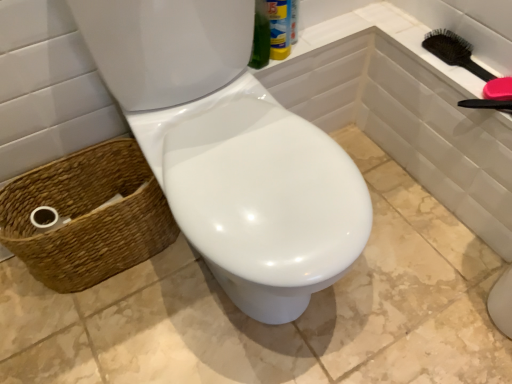
Find the location of `white glossy toilet at center`. white glossy toilet at center is located at coordinates (230, 151).

Where is `black plastic hairbrush at upper right`? Image resolution: width=512 pixels, height=384 pixels. black plastic hairbrush at upper right is located at coordinates click(454, 52).

Consider the image. Which of these two, white glossy toilet at center or woven brown basket at lower left, is wider?

woven brown basket at lower left.

How different are the orientations of white glossy toilet at center and woven brown basket at lower left in degrees?

0.00139 degrees separate the facing orientations of white glossy toilet at center and woven brown basket at lower left.

Based on the photo, how far apart are white glossy toilet at center and woven brown basket at lower left?

white glossy toilet at center is 13.34 inches away from woven brown basket at lower left.

Where is `basket behind the white glossy toilet at center`? The width and height of the screenshot is (512, 384). basket behind the white glossy toilet at center is located at coordinates (88, 216).

Is black plastic hairbrush at upper right completely or partially outside of white glossy toilet at center?

Yes, black plastic hairbrush at upper right is located beyond the bounds of white glossy toilet at center.

From a real-world perspective, is black plastic hairbrush at upper right located beneath white glossy toilet at center?

No, from a real-world perspective, black plastic hairbrush at upper right is not below white glossy toilet at center.

At what (x,y) coordinates should I click in order to perform the action: click on brush above the white glossy toilet at center (from a real-world perspective). Please return your answer as a coordinate pair (x, y). Image resolution: width=512 pixels, height=384 pixels. Looking at the image, I should click on (454, 52).

In the image, is black plastic hairbrush at upper right positioned in front of or behind white glossy toilet at center?

Visually, black plastic hairbrush at upper right is located behind white glossy toilet at center.

Visually, is black plastic hairbrush at upper right positioned to the left or to the right of woven brown basket at lower left?

Based on their positions, black plastic hairbrush at upper right is located to the right of woven brown basket at lower left.

Identify the location of brush lying on the right of woven brown basket at lower left. This screenshot has height=384, width=512. (454, 52).

Considering the positions of points (438, 52) and (1, 195), is point (438, 52) closer to camera compared to point (1, 195)?

No, it is not.

Which of these two, woven brown basket at lower left or white glossy toilet at center, stands shorter?

woven brown basket at lower left.

From the image's perspective, between woven brown basket at lower left and white glossy toilet at center, which one is located above?

white glossy toilet at center is shown above in the image.

Between woven brown basket at lower left and white glossy toilet at center, which one has smaller width?

white glossy toilet at center is thinner.

Would you say woven brown basket at lower left contains white glossy toilet at center?

That's incorrect, white glossy toilet at center is not inside woven brown basket at lower left.

Between white glossy toilet at center and black plastic hairbrush at upper right, which one has smaller width?

white glossy toilet at center.

Can you confirm if white glossy toilet at center is positioned to the left of black plastic hairbrush at upper right?

Yes, white glossy toilet at center is to the left of black plastic hairbrush at upper right.

Is white glossy toilet at center touching black plastic hairbrush at upper right?

No.

Looking at this image, is white glossy toilet at center looking in the opposite direction of black plastic hairbrush at upper right?

That's not correct — white glossy toilet at center is not looking away from black plastic hairbrush at upper right.

Would you say black plastic hairbrush at upper right is part of woven brown basket at lower left's contents?

No, black plastic hairbrush at upper right is not inside woven brown basket at lower left.

Which of these two, woven brown basket at lower left or black plastic hairbrush at upper right, is thinner?

With smaller width is black plastic hairbrush at upper right.

Considering the sizes of objects woven brown basket at lower left and black plastic hairbrush at upper right in the image provided, who is taller, woven brown basket at lower left or black plastic hairbrush at upper right?

With more height is woven brown basket at lower left.

From the image's perspective, is woven brown basket at lower left under black plastic hairbrush at upper right?

Yes, from the image's perspective, woven brown basket at lower left is below black plastic hairbrush at upper right.

In order to click on toilet in front of the woven brown basket at lower left in this screenshot , I will do `click(230, 151)`.

The width and height of the screenshot is (512, 384). I want to click on toilet on the left of the black plastic hairbrush at upper right, so click(230, 151).

Looking at the image, which one is located further to black plastic hairbrush at upper right, woven brown basket at lower left or white glossy toilet at center?

The object further to black plastic hairbrush at upper right is woven brown basket at lower left.

Based on their spatial positions, is black plastic hairbrush at upper right or white glossy toilet at center closer to woven brown basket at lower left?

Based on the image, white glossy toilet at center appears to be nearer to woven brown basket at lower left.

When comparing their distances from white glossy toilet at center, does black plastic hairbrush at upper right or woven brown basket at lower left seem further?

The object further to white glossy toilet at center is black plastic hairbrush at upper right.

Which object lies nearer to the anchor point black plastic hairbrush at upper right, white glossy toilet at center or woven brown basket at lower left?

Among the two, white glossy toilet at center is located nearer to black plastic hairbrush at upper right.

Which object lies further to the anchor point white glossy toilet at center, woven brown basket at lower left or black plastic hairbrush at upper right?

black plastic hairbrush at upper right.

Which object lies further to the anchor point woven brown basket at lower left, white glossy toilet at center or black plastic hairbrush at upper right?

Based on the image, black plastic hairbrush at upper right appears to be further to woven brown basket at lower left.

Locate an element on the screen. The height and width of the screenshot is (384, 512). toilet situated between woven brown basket at lower left and black plastic hairbrush at upper right from left to right is located at coordinates (230, 151).